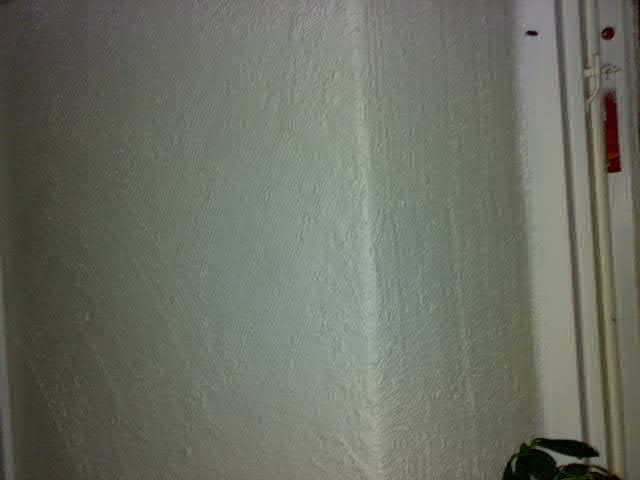
The image size is (640, 480). What are the coordinates of `molding for a doorway` in the screenshot? It's located at (592, 225), (576, 17), (603, 339).